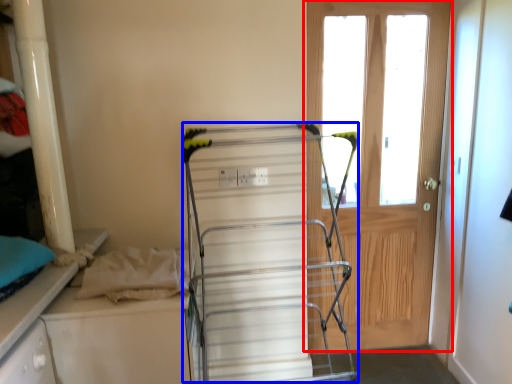
Question: Which point is closer to the camera, door (highlighted by a red box) or wide (highlighted by a blue box)?

Choices:
 (A) door
 (B) wide

Answer: (B)